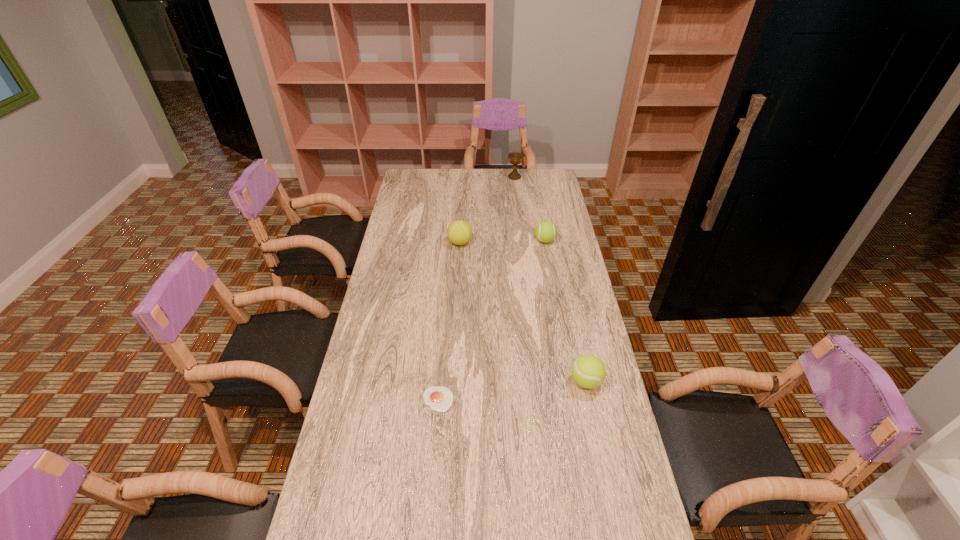
The height and width of the screenshot is (540, 960). I want to click on object that is the third closest one to the nearest tennis ball, so (459, 232).

I want to click on the closest object to the tallest object, so click(x=545, y=231).

Where is `tennis ball that can be found as the second closest to the shortest object`? The image size is (960, 540). tennis ball that can be found as the second closest to the shortest object is located at coordinates (459, 232).

Image resolution: width=960 pixels, height=540 pixels. I want to click on tennis ball that stands as the closest to the nearest tennis ball, so tap(545, 231).

What are the coordinates of `free region that satisfies the following two spatial constraints: 1. on the back side of the egg yolk; 2. on the left side of the third object from right to left` in the screenshot? It's located at (456, 177).